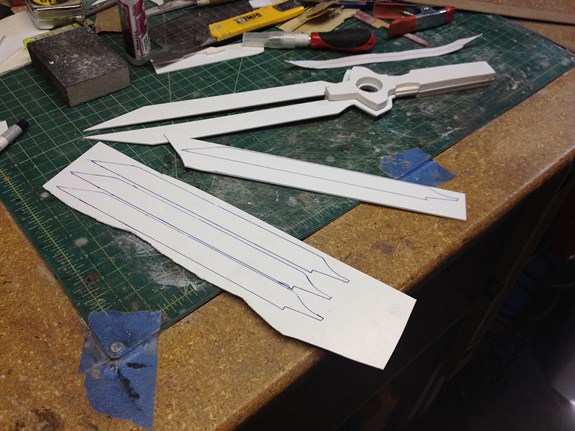
Locate an element on the screen. The height and width of the screenshot is (431, 575). pen is located at coordinates (13, 129).